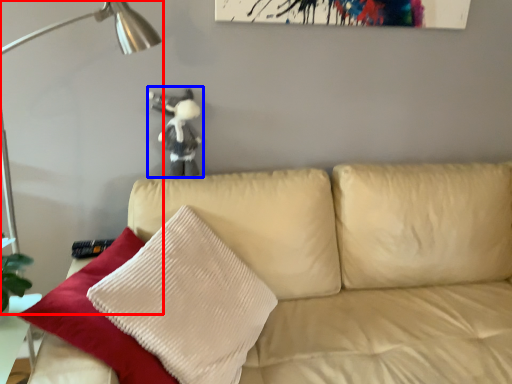
Question: Which object is closer to the camera taking this photo, table lamp (highlighted by a red box) or figurine (highlighted by a blue box)?

Choices:
 (A) table lamp
 (B) figurine

Answer: (A)